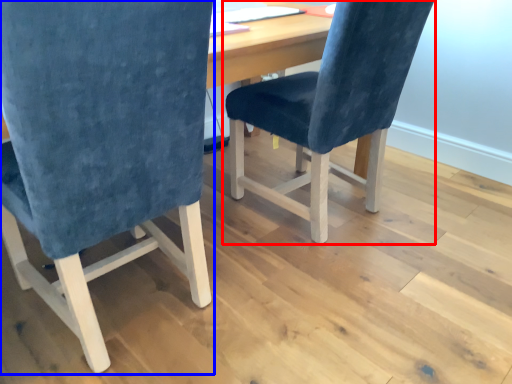
Question: Among these objects, which one is nearest to the camera, chair (highlighted by a red box) or chair (highlighted by a blue box)?

Choices:
 (A) chair
 (B) chair

Answer: (B)